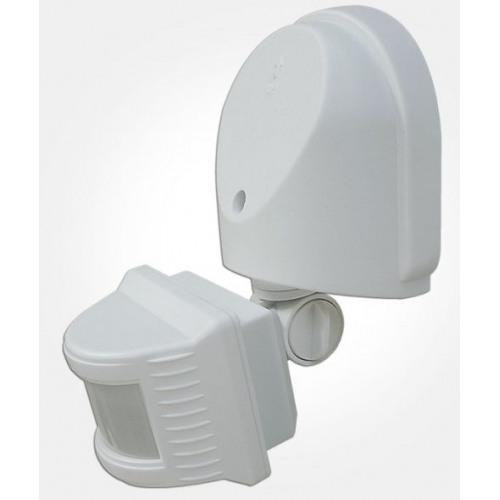
This screenshot has width=500, height=500. What are the coordinates of `hinge` in the screenshot? It's located at (292, 310).